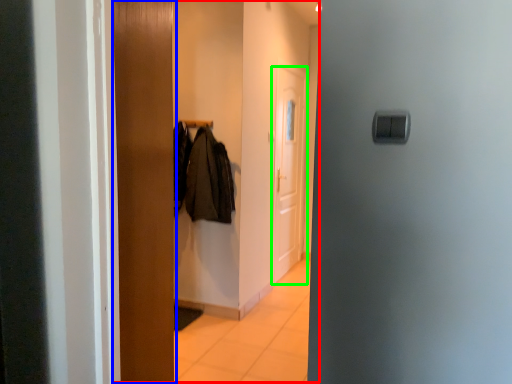
Question: Which is nearer to the dresser (highlighted by a red box)? door (highlighted by a blue box) or door (highlighted by a green box).

Choices:
 (A) door
 (B) door

Answer: (B)